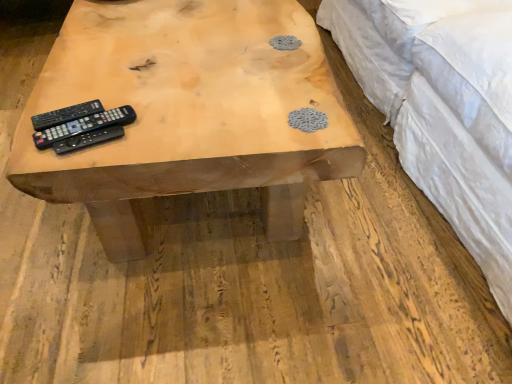
The height and width of the screenshot is (384, 512). I want to click on empty space that is to the right of black matte remote control at center, which appears as the first remote control when viewed from the front, so [x=167, y=127].